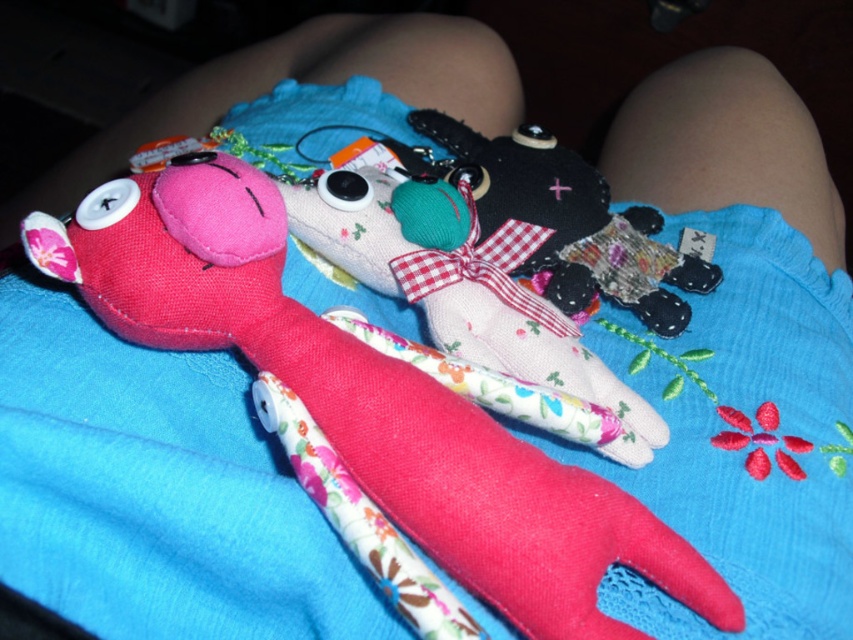
Question: Is floral fabric stuffed animal at center behind flannel fabric stuffed animal at center?

Choices:
 (A) yes
 (B) no

Answer: (B)

Question: Which point is closer to the camera?

Choices:
 (A) flannel fabric stuffed animal at center
 (B) floral fabric stuffed animal at center

Answer: (B)

Question: Does floral fabric stuffed animal at center lie behind flannel fabric stuffed animal at center?

Choices:
 (A) yes
 (B) no

Answer: (B)

Question: Does floral fabric stuffed animal at center appear on the left side of flannel fabric stuffed animal at center?

Choices:
 (A) no
 (B) yes

Answer: (B)

Question: Which of the following is the farthest from the observer?

Choices:
 (A) flannel fabric stuffed animal at center
 (B) floral fabric stuffed animal at center

Answer: (A)